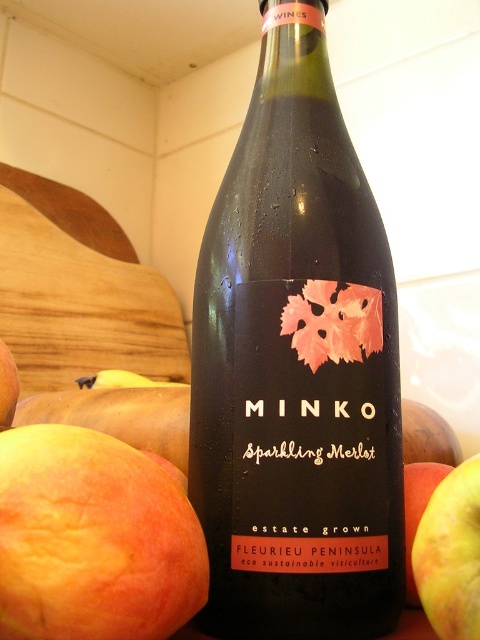
Which is in front, point (107, 500) or point (408, 492)?

Point (107, 500)

Is the position of ripe peach at lower left less distant than that of smooth yellow apple at right?

Yes, it is.

What do you see at coordinates (93, 540) in the screenshot? I see `ripe peach at lower left` at bounding box center [93, 540].

You are a GUI agent. You are given a task and a screenshot of the screen. Output one action in this format:
    pyautogui.click(x=<x>, y=<y>)
    Task: Click on the ripe peach at lower left
    
    Given the screenshot: What is the action you would take?
    pyautogui.click(x=93, y=540)

Is the position of matte glass bottle at center less distant than that of yellow matte apple at lower right?

No, matte glass bottle at center is behind yellow matte apple at lower right.

Is matte glass bottle at center behind yellow matte apple at lower right?

Yes, it is.

Which is in front, point (253, 508) or point (467, 460)?

Positioned in front is point (253, 508).

Find the location of a particular element. This screenshot has height=640, width=480. matte glass bottle at center is located at coordinates (x=297, y=365).

Based on the photo, is ripe peach at lower left positioned before yellow matte apple at lower right?

Yes.

Is point (158, 589) positioned in front of point (470, 600)?

Yes, it is.

The width and height of the screenshot is (480, 640). In order to click on ripe peach at lower left in this screenshot , I will do pyautogui.click(x=93, y=540).